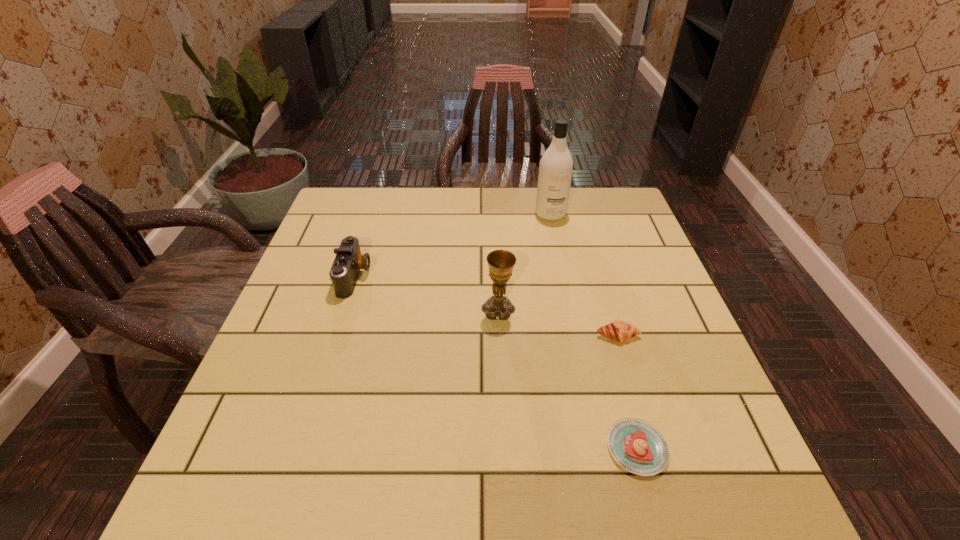
Image resolution: width=960 pixels, height=540 pixels. I want to click on free space at the left edge of the desktop, so click(x=332, y=245).

This screenshot has width=960, height=540. In the image, there is a desktop. In order to click on vacant space at the right edge in this screenshot , I will do `click(709, 383)`.

Where is `vacant space at the far left corner of the desktop`? vacant space at the far left corner of the desktop is located at coordinates (357, 190).

At what (x,y) coordinates should I click in order to perform the action: click on vacant space at the near left corner of the desktop. Please return your answer as a coordinate pair (x, y). The height and width of the screenshot is (540, 960). Looking at the image, I should click on (296, 474).

Find the location of `free location at the far right corner`. free location at the far right corner is located at coordinates (614, 200).

Identify the location of empty space between the fourth farthest object and the fourth object from right to left. The height and width of the screenshot is (540, 960). (558, 322).

What are the coordinates of `free space between the fourth farthest object and the nearer pastry` in the screenshot? It's located at (628, 393).

At what (x,y) coordinates should I click in order to perform the action: click on vacant space that's between the camera and the shortest object. Please return your answer as a coordinate pair (x, y). This screenshot has height=540, width=960. Looking at the image, I should click on (496, 362).

The image size is (960, 540). Find the location of `vacant space in between the farther pastry and the chalice`. vacant space in between the farther pastry and the chalice is located at coordinates (558, 322).

Locate an element on the screen. free space between the shortest object and the third tallest object is located at coordinates (496, 362).